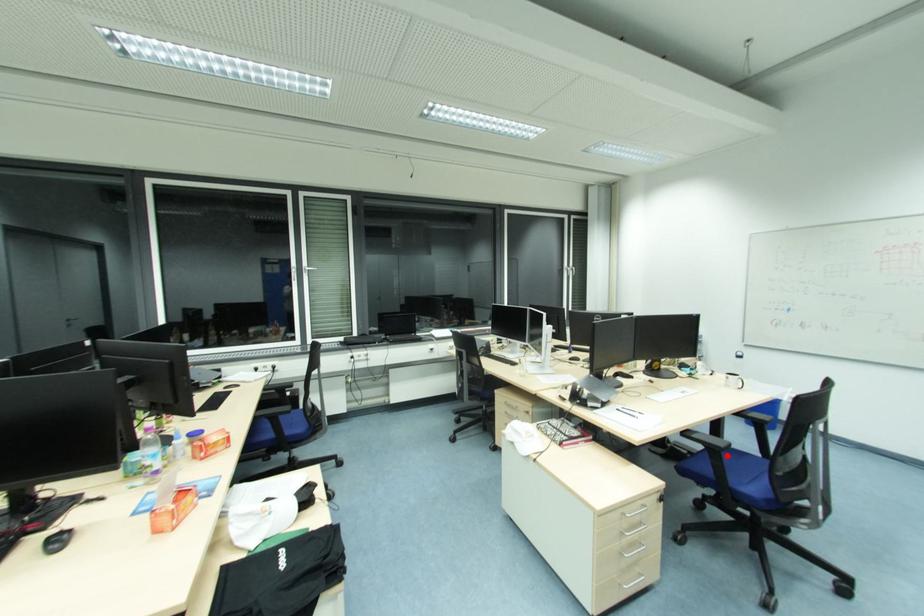
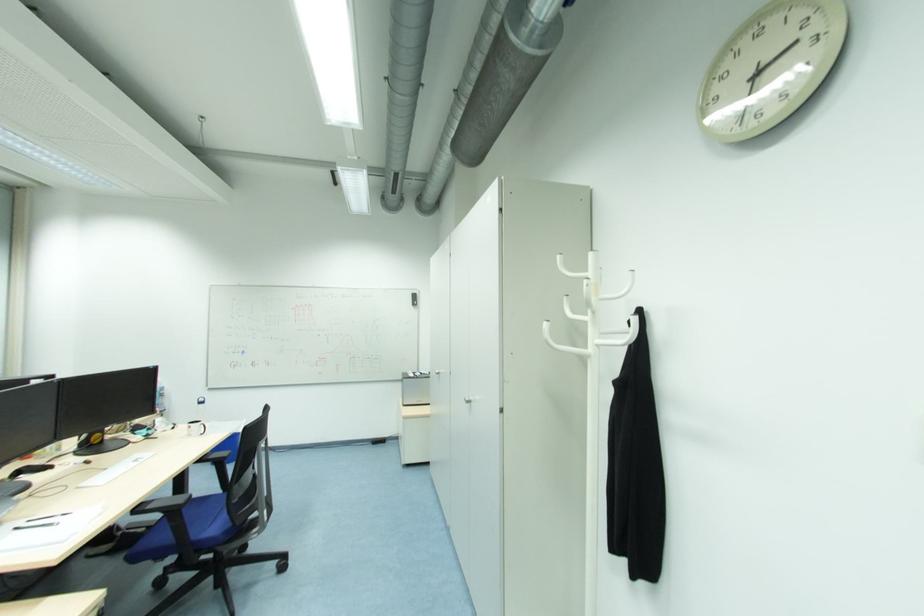
Find the pixel in the second image that matches the highlighted location in the first image.

(187, 512)